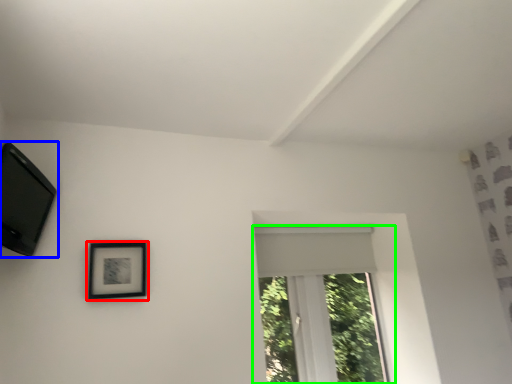
Question: Which object is the closest to the picture frame (highlighted by a red box)? Choose among these: picture frame (highlighted by a blue box) or window (highlighted by a green box).

Choices:
 (A) picture frame
 (B) window

Answer: (A)